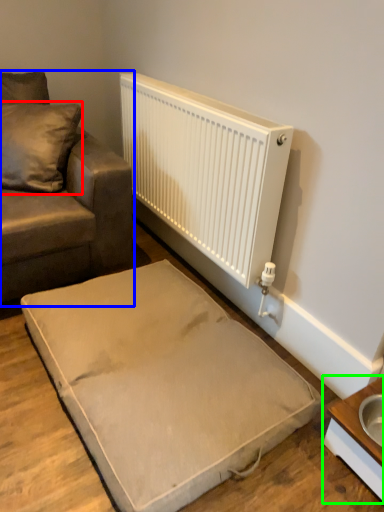
Question: Which object is positioned farthest from pillow (highlighted by a red box)? Select from studio couch (highlighted by a blue box) and table (highlighted by a green box).

Choices:
 (A) studio couch
 (B) table

Answer: (B)